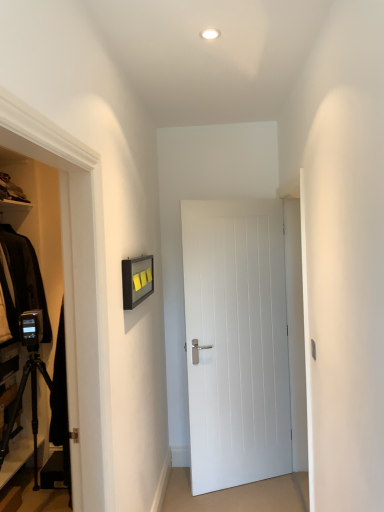
Where is `free space in front of white smooth door at center`? This screenshot has height=512, width=384. free space in front of white smooth door at center is located at coordinates (256, 500).